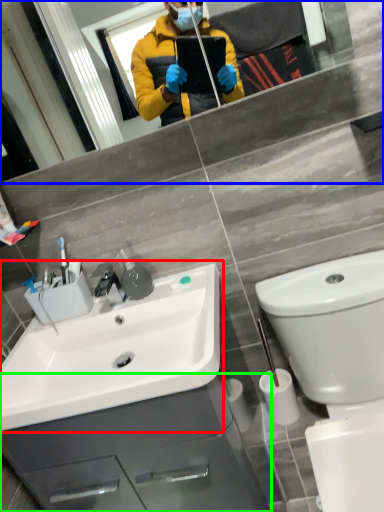
Question: Which is nearer to the sink (highlighted by a red box)? mirror (highlighted by a blue box) or bathroom cabinet (highlighted by a green box).

Choices:
 (A) mirror
 (B) bathroom cabinet

Answer: (B)